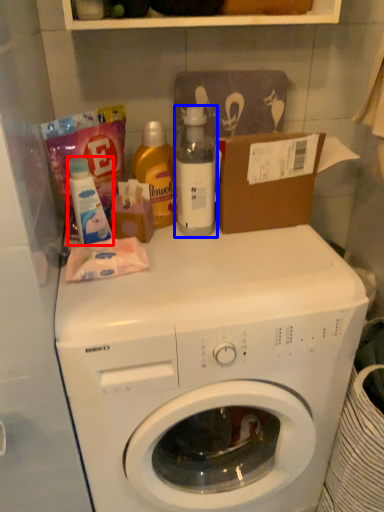
Question: Among these objects, which one is farthest to the camera, cleaning product (highlighted by a red box) or bottle (highlighted by a blue box)?

Choices:
 (A) cleaning product
 (B) bottle

Answer: (B)